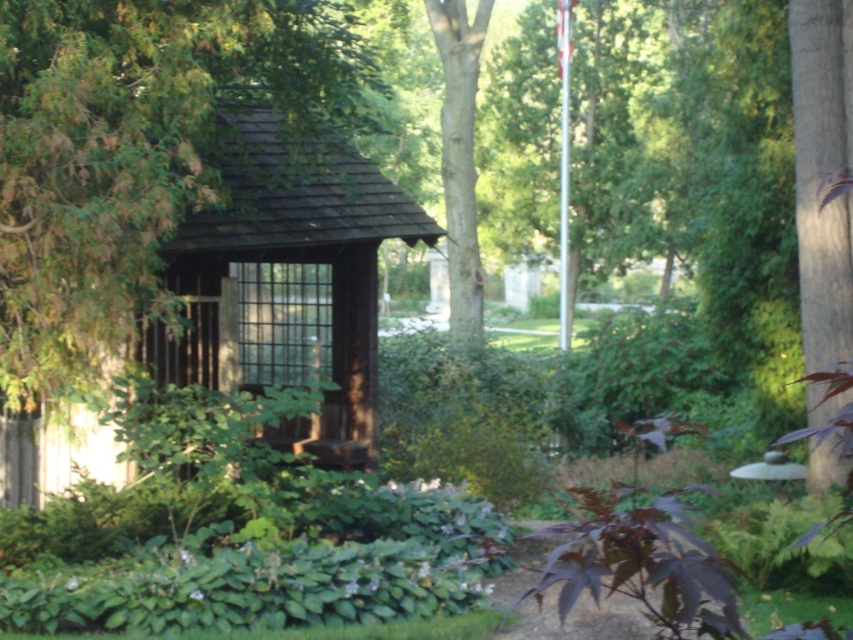
Is brown wooden hut at center to the right of smooth brown bark at upper center from the viewer's perspective?

Incorrect, brown wooden hut at center is not on the right side of smooth brown bark at upper center.

Between brown wooden hut at center and smooth brown bark at upper center, which one appears on the right side from the viewer's perspective?

→ From the viewer's perspective, smooth brown bark at upper center appears more on the right side.

Which is behind, point (20, 490) or point (440, 129)?

The point (440, 129) is more distant.

Where is `brown wooden hut at center`? Image resolution: width=853 pixels, height=640 pixels. brown wooden hut at center is located at coordinates 286,284.

Is brown wooden hut at center below green textured bark at right?

No.

Which is in front, point (158, 328) or point (833, 17)?

Point (833, 17) is more forward.

Locate an element on the screen. The image size is (853, 640). brown wooden hut at center is located at coordinates (286, 284).

Does green textured bark at right have a greater width compared to smooth brown bark at upper center?

Indeed, green textured bark at right has a greater width compared to smooth brown bark at upper center.

From the picture: Who is more forward, (x=827, y=449) or (x=456, y=148)?

Point (x=827, y=449) is in front.

The image size is (853, 640). Find the location of `green textured bark at right`. green textured bark at right is located at coordinates (822, 173).